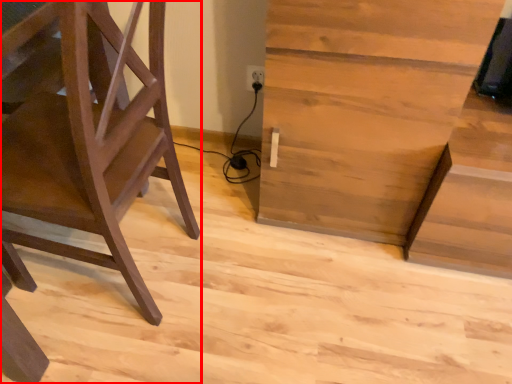
Question: Observing the image, what is the correct spatial positioning of furniture (annotated by the red box) in reference to table?

Choices:
 (A) right
 (B) left

Answer: (B)